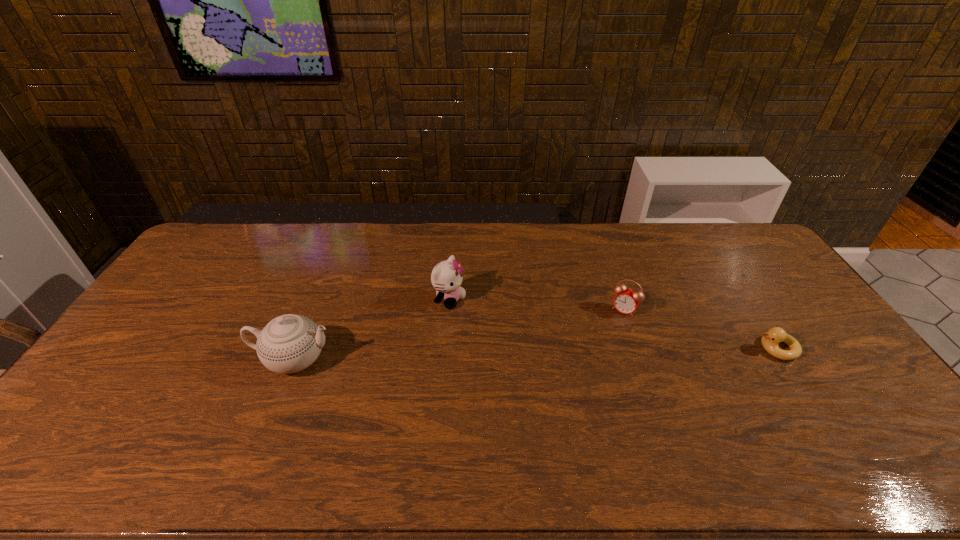
Locate an element on the screen. The width and height of the screenshot is (960, 540). chinaware is located at coordinates (289, 343).

At what (x,y) coordinates should I click in order to perform the action: click on duckling. Please return your answer as a coordinate pair (x, y). The width and height of the screenshot is (960, 540). Looking at the image, I should click on (770, 340).

Identify the location of the rightmost object. The width and height of the screenshot is (960, 540). (770, 340).

I want to click on kitten, so click(x=446, y=277).

Locate an element on the screen. The width and height of the screenshot is (960, 540). the third object from left to right is located at coordinates [x=626, y=301].

You are a GUI agent. You are given a task and a screenshot of the screen. Output one action in this format:
    pyautogui.click(x=<x>, y=<y>)
    Task: Click on the second shortest object
    The image size is (960, 540).
    Given the screenshot: What is the action you would take?
    pyautogui.click(x=626, y=301)

I want to click on blank space located on the spout of the chinaware, so click(x=472, y=359).

Identify the location of blank space located at the beak of the duckling. (715, 348).

Locate an element on the screen. The height and width of the screenshot is (540, 960). vacant space located 0.170m at the beak of the duckling is located at coordinates (698, 348).

Locate an element on the screen. The width and height of the screenshot is (960, 540). free space located at the beak of the duckling is located at coordinates (726, 348).